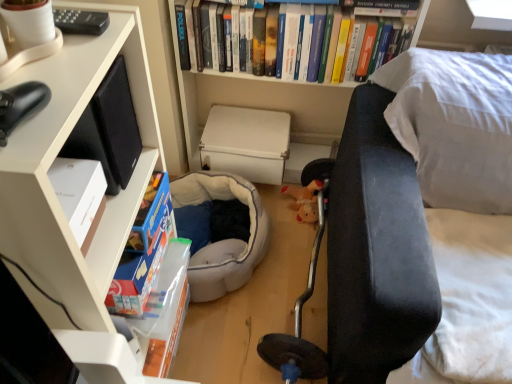
Question: Based on their sizes in the image, would you say soft gray fabric bean bag at center is bigger or smaller than white matte box at center?

Choices:
 (A) small
 (B) big

Answer: (B)

Question: Does point (205, 299) appear closer or farther from the camera than point (226, 145)?

Choices:
 (A) closer
 (B) farther

Answer: (A)

Question: Considering the real-world distances, which object is closest to the white matte bookcase at upper center, placed as the 2th bookcase when sorted from front to back?

Choices:
 (A) velvet dark blue couch at right
 (B) soft gray fabric bean bag at center
 (C) white matte bookcase at left, the first bookcase when ordered from left to right
 (D) white matte box at center
 (E) hardcover books at upper center

Answer: (D)

Question: Based on their relative distances, which object is farther from the white matte box at center?

Choices:
 (A) soft gray fabric bean bag at center
 (B) hardcover books at upper center
 (C) velvet dark blue couch at right
 (D) white matte bookcase at upper center, placed as the 2th bookcase when sorted from front to back
 (E) white matte bookcase at left, the 2th bookcase viewed from the right

Answer: (E)